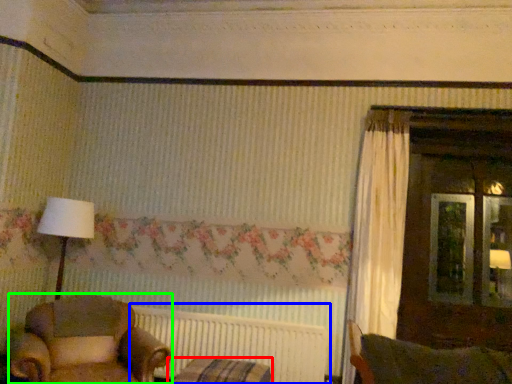
Question: Based on their relative distances, which object is nearer to furniture (highlighted by a red box)? Choose from radiator (highlighted by a blue box) and chair (highlighted by a green box).

Choices:
 (A) radiator
 (B) chair

Answer: (A)